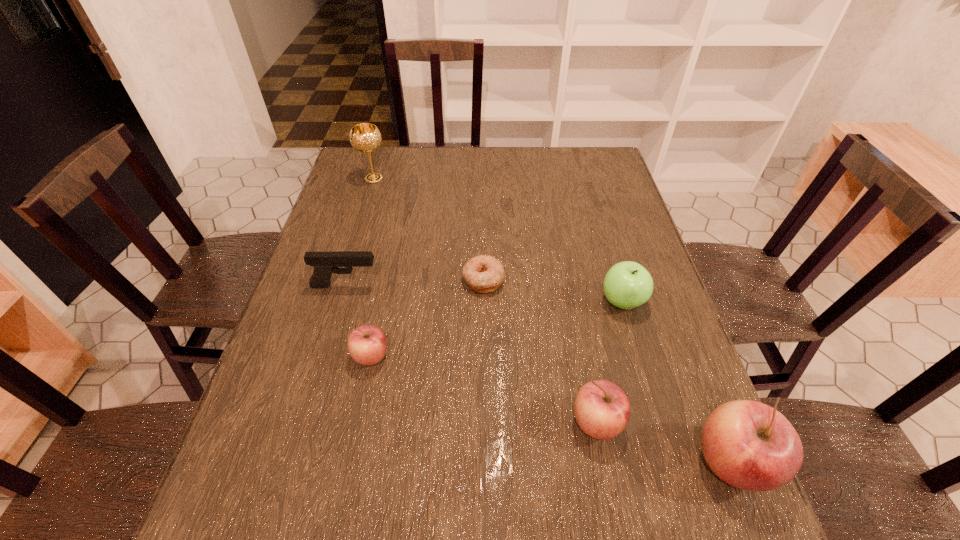
Where is `the shortest apple`? The width and height of the screenshot is (960, 540). the shortest apple is located at coordinates (367, 344).

Find the location of a particular element. The height and width of the screenshot is (540, 960). the leftmost apple is located at coordinates (367, 344).

The width and height of the screenshot is (960, 540). I want to click on the fifth object from left to right, so click(602, 409).

You are a GUI agent. You are given a task and a screenshot of the screen. Output one action in this format:
    pyautogui.click(x=<x>, y=<y>)
    Task: Click on the tallest apple
    
    Given the screenshot: What is the action you would take?
    pyautogui.click(x=749, y=445)

Locate an element on the screen. The image size is (960, 540). the farthest object is located at coordinates (365, 137).

Locate an element on the screen. the farthest apple is located at coordinates tap(627, 285).

Where is `the shortest object`? The height and width of the screenshot is (540, 960). the shortest object is located at coordinates (482, 273).

I want to click on the fourth object from right to left, so click(x=482, y=273).

Identify the location of pistol. (324, 264).

The image size is (960, 540). Identify the location of free location located on the back of the leftmost apple. (394, 247).